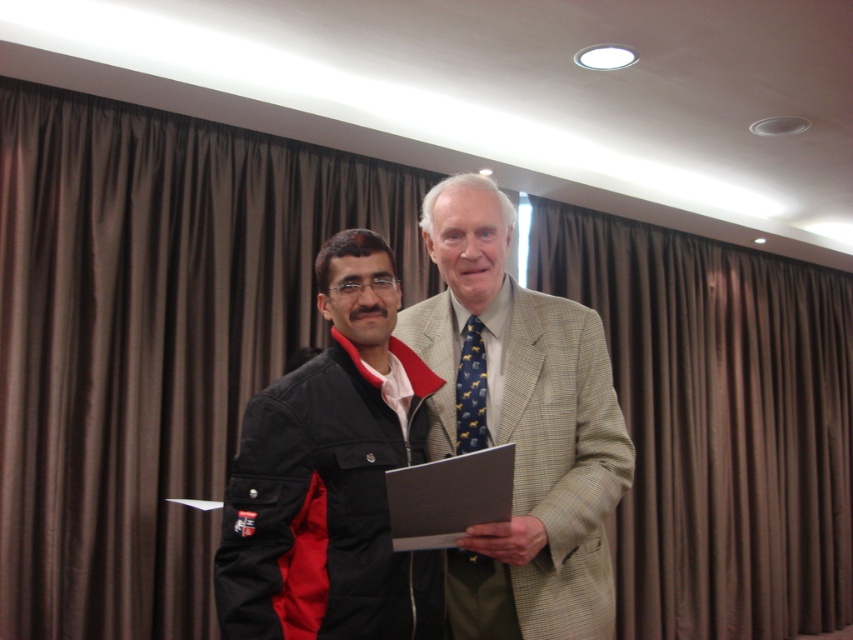
You are a photographer at an event and need to ensure that both the light beige textured suit at center and the blue patterned tie at center are visible in the photo. Given their sizes, which one might require more careful framing to avoid being obscured?

The light beige textured suit at center is larger in size than the blue patterned tie at center, so the suit may require more careful framing to ensure it doesn not get obscured in the photo.

Based on the scene description, where is the light beige textured suit at center located in terms of its 2D coordinates?

The light beige textured suit at center is located at the 2D coordinates point (521, 428).